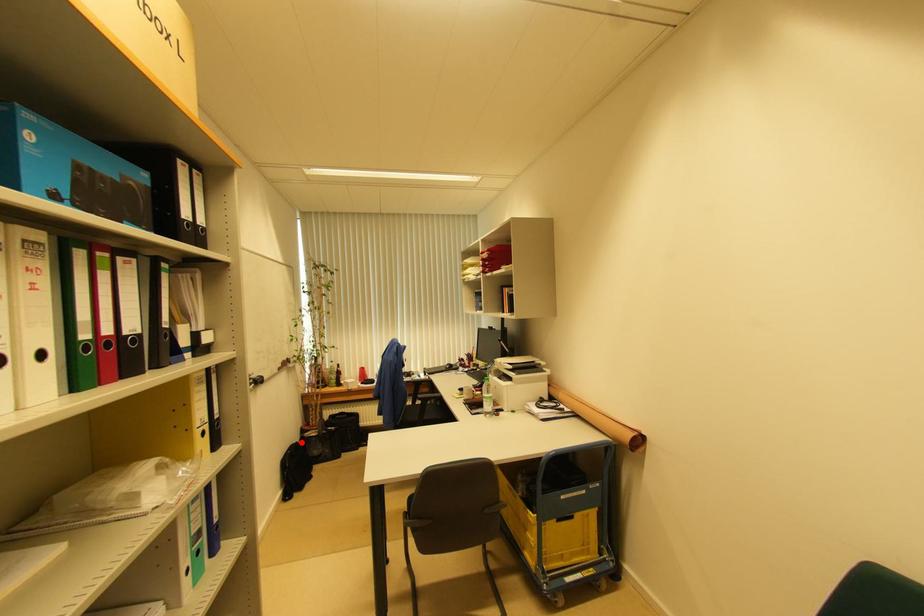
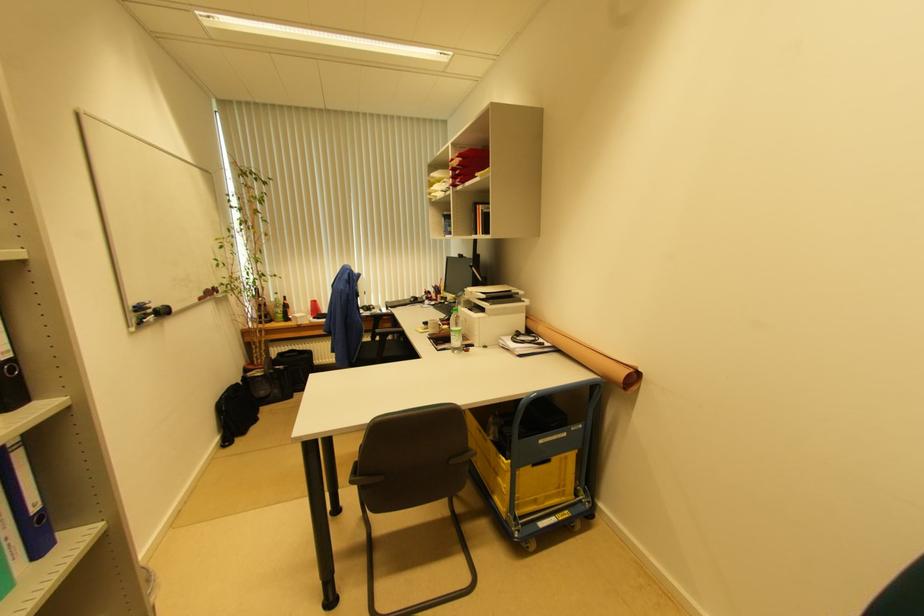
The point at the highlighted location is marked in the first image. Where is the corresponding point in the second image?

(242, 383)